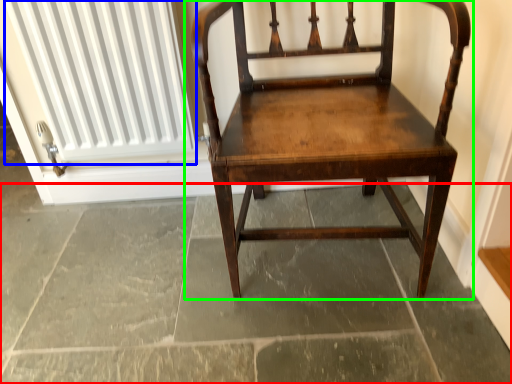
Question: Considering the real-world distances, which object is farthest from concrete (highlighted by a red box)? radiator (highlighted by a blue box) or chair (highlighted by a green box)?

Choices:
 (A) radiator
 (B) chair

Answer: (A)